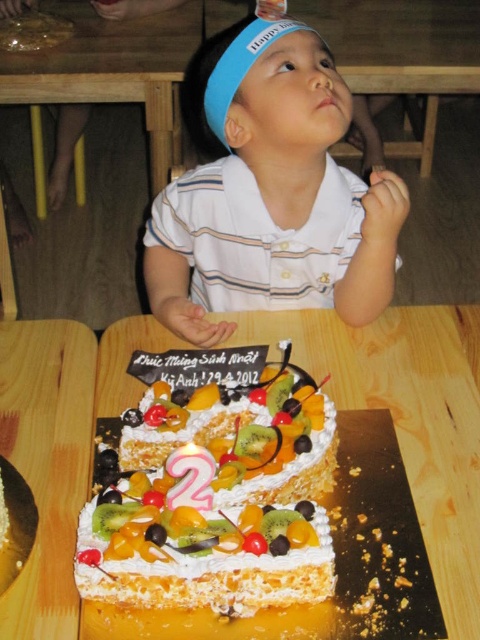
You are a photographer at the birthday party. You want to take a picture of the whipped cream topped cake at center and the white striped shirt at center. Which object is shorter in height?

The whipped cream topped cake at center has a lesser height compared to the white striped shirt at center, so the cake is shorter.

You are planning to place a birthday gift on the wooden table at lower center. Based on the scene description, where exactly should you position the gift to avoid covering the cake?

The wooden table at lower center is located at point (409,419), so placing the gift outside of this coordinate area would ensure it doesn not cover the cake.

You are a guest at the birthday party and want to place a small gift on the wooden table at lower center. The gift is 10 cm tall. Can you safely place it there without it touching the whipped cream topped cake at center?

The wooden table at lower center is taller than the whipped cream topped cake at center, so placing a 10 cm tall gift on the wooden table at lower center would not cause it to touch the cake since the table is elevated higher than the cake.